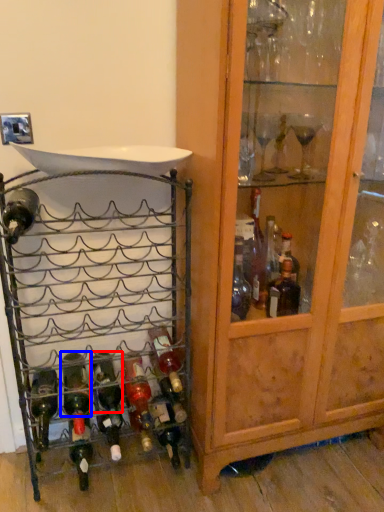
Question: Which object is further to the camera taking this photo, bottle (highlighted by a red box) or bottle (highlighted by a blue box)?

Choices:
 (A) bottle
 (B) bottle

Answer: (A)